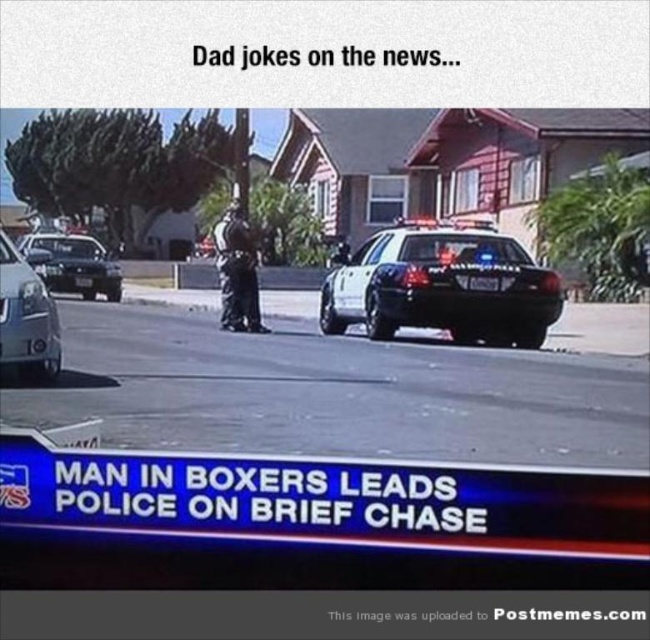
Question: Does white glossy police car at center appear under silver metallic sedan at lower left?

Choices:
 (A) yes
 (B) no

Answer: (B)

Question: Which object is the closest to the dark gray uniform at center?

Choices:
 (A) white glossy police car at center
 (B) black glossy sedan at center

Answer: (A)

Question: Which object is positioned farthest from the dark gray uniform at center?

Choices:
 (A) white glossy police car at center
 (B) black glossy sedan at center

Answer: (B)

Question: Among these points, which one is farthest from the camera?

Choices:
 (A) (380, 323)
 (B) (44, 280)

Answer: (B)

Question: Is white glossy police car at center smaller than black glossy sedan at center?

Choices:
 (A) yes
 (B) no

Answer: (A)

Question: Can you confirm if white glossy police car at center is bigger than black glossy sedan at center?

Choices:
 (A) no
 (B) yes

Answer: (A)